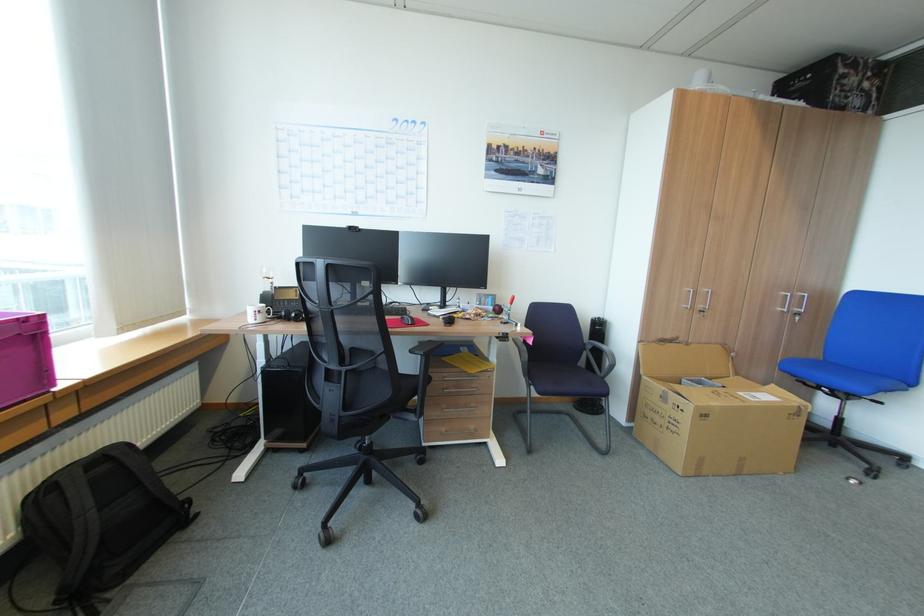
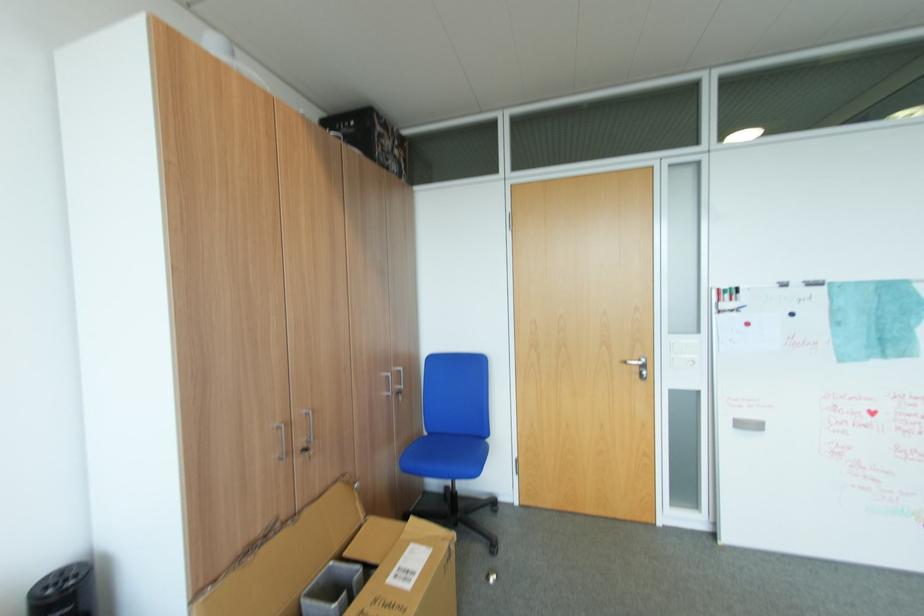
Find the pixel in the second image that matches the point at 785,309 in the first image.

(390, 394)